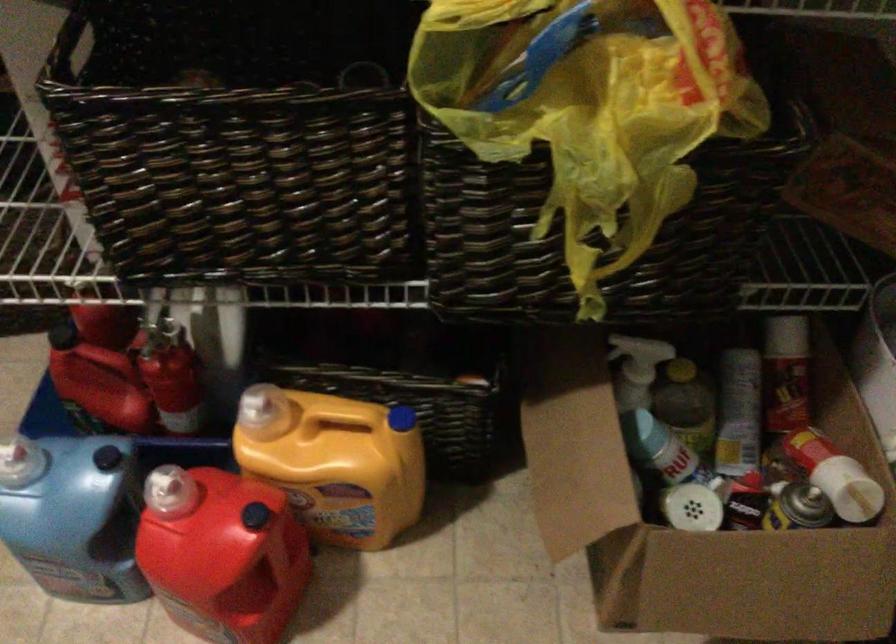
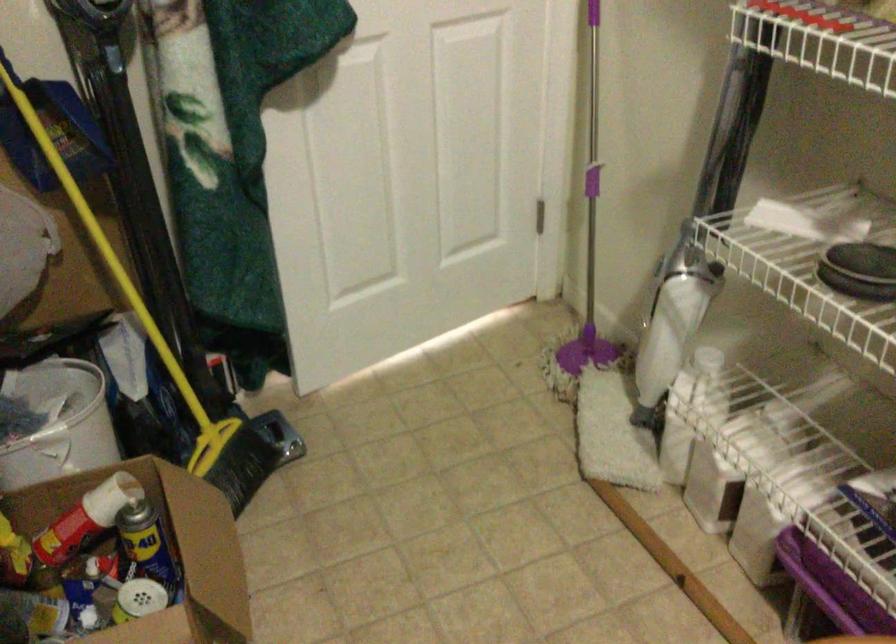
Locate, in the second image, the point that corresponds to the point at 812,457 in the first image.

(85, 518)